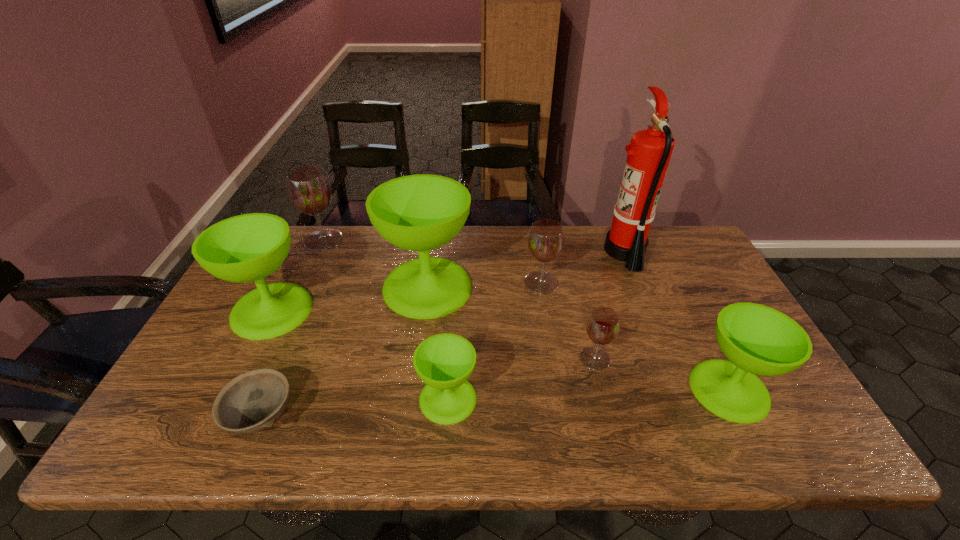
Where is `object situated at the far left corner`? This screenshot has width=960, height=540. object situated at the far left corner is located at coordinates (308, 187).

Identify the location of object situated at the near right corner. This screenshot has width=960, height=540. (x=756, y=339).

Find the location of `vacant space at the far edge of the desktop`. vacant space at the far edge of the desktop is located at coordinates (521, 245).

This screenshot has height=540, width=960. In the image, there is a desktop. In order to click on vacant space at the left edge in this screenshot , I will do `click(214, 374)`.

Locate an element on the screen. vacant position at the right edge of the desktop is located at coordinates (668, 275).

Where is `vacant space at the far left corner`? vacant space at the far left corner is located at coordinates (298, 245).

In the image, there is a desktop. What are the coordinates of `vacant space at the far right corner` in the screenshot? It's located at (676, 242).

At what (x,y) coordinates should I click in order to perform the action: click on empty space that is in between the rightmost green wineglass and the eighth shortest object. Please return your answer as a coordinate pair (x, y). The image size is (960, 540). Looking at the image, I should click on (578, 338).

Where is `vacant space in between the farthest red wineglass and the smallest green wineglass`? The height and width of the screenshot is (540, 960). vacant space in between the farthest red wineglass and the smallest green wineglass is located at coordinates (386, 320).

Locate an element on the screen. This screenshot has width=960, height=540. vacant region between the smallest green wineglass and the shortest object is located at coordinates (355, 408).